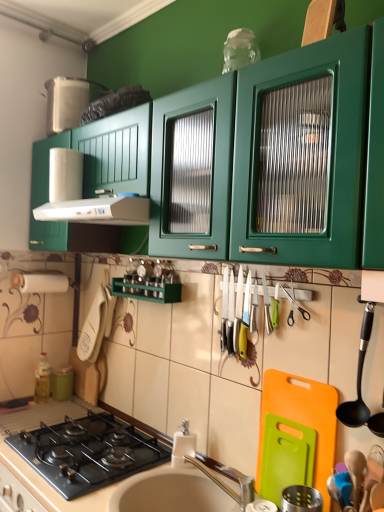
Where is `space that is in front of green matte canister at lower left, which is the first appliance in back-to-front order`? Image resolution: width=384 pixels, height=512 pixels. space that is in front of green matte canister at lower left, which is the first appliance in back-to-front order is located at coordinates (52, 403).